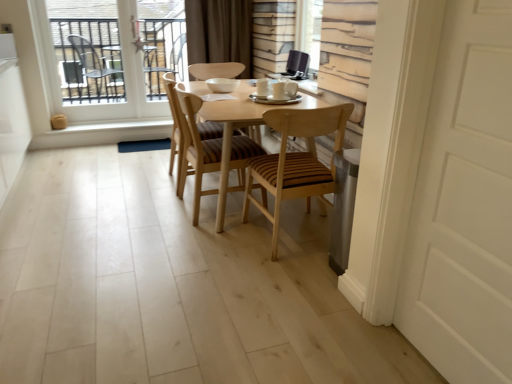
The width and height of the screenshot is (512, 384). Find the location of `vacant area in front of wooden at center, which is the 1th chair from left to right`. vacant area in front of wooden at center, which is the 1th chair from left to right is located at coordinates (156, 207).